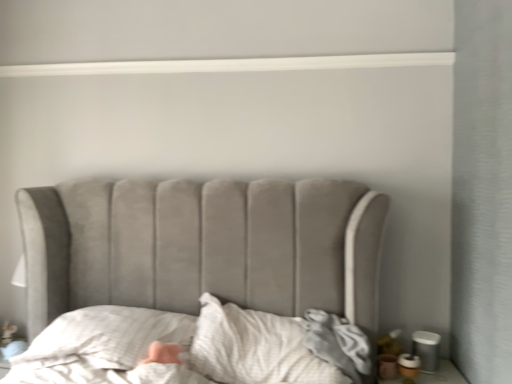
Locate an element on the screen. The width and height of the screenshot is (512, 384). white textured sheet at center is located at coordinates (257, 347).

What do you see at coordinates (257, 347) in the screenshot? The image size is (512, 384). I see `white textured sheet at center` at bounding box center [257, 347].

The image size is (512, 384). What do you see at coordinates (106, 337) in the screenshot?
I see `white textured pillow at lower left` at bounding box center [106, 337].

Find the location of `white textured pillow at lower left`. white textured pillow at lower left is located at coordinates (106, 337).

What is the approximate height of white textured pillow at lower left?

The height of white textured pillow at lower left is 14.50 inches.

Locate an element on the screen. This screenshot has height=384, width=512. white textured sheet at center is located at coordinates click(257, 347).

Would you say white textured sheet at center is to the left or to the right of white textured pillow at lower left in the picture?

Clearly, white textured sheet at center is on the right of white textured pillow at lower left in the image.

Which is in front, white textured sheet at center or white textured pillow at lower left?

white textured sheet at center is closer to the camera.

Does point (204, 338) lie in front of point (35, 345)?

Yes, it is in front of point (35, 345).

From the image's perspective, which one is positioned higher, white textured sheet at center or white textured pillow at lower left?

From the image's view, white textured pillow at lower left is above.

From a real-world perspective, is white textured sheet at center over white textured pillow at lower left?

Incorrect, from a real-world perspective, white textured sheet at center is lower than white textured pillow at lower left.

Considering the sizes of objects white textured sheet at center and white textured pillow at lower left in the image provided, who is wider, white textured sheet at center or white textured pillow at lower left?

Wider between the two is white textured pillow at lower left.

Which of these two, white textured sheet at center or white textured pillow at lower left, stands taller?

white textured sheet at center.

Considering the sizes of white textured sheet at center and white textured pillow at lower left in the image, is white textured sheet at center bigger or smaller than white textured pillow at lower left?

In the image, white textured sheet at center appears to be larger than white textured pillow at lower left.

Choose the correct answer: Is white textured sheet at center inside white textured pillow at lower left or outside it?

The correct answer is: outside.

Is white textured sheet at center touching white textured pillow at lower left?

white textured sheet at center is not next to white textured pillow at lower left, and they're not touching.

Is white textured sheet at center positioned with its back to white textured pillow at lower left?

That's not correct — white textured sheet at center is not looking away from white textured pillow at lower left.

The height and width of the screenshot is (384, 512). I want to click on throw pillow above the white textured sheet at center (from the image's perspective), so click(x=106, y=337).

Is white textured pillow at lower left at the left side of white textured sheet at center?

Correct, you'll find white textured pillow at lower left to the left of white textured sheet at center.

Which is behind, white textured pillow at lower left or white textured sheet at center?

white textured pillow at lower left.

Is point (102, 308) closer or farther from the camera than point (303, 343)?

Point (102, 308) appears to be farther away from the viewer than point (303, 343).

From the image's perspective, which is below, white textured pillow at lower left or white textured sheet at center?

white textured sheet at center is shown below in the image.

From a real-world perspective, which is physically above, white textured pillow at lower left or white textured sheet at center?

white textured pillow at lower left, from a real-world perspective.

Can you confirm if white textured pillow at lower left is thinner than white textured sheet at center?

Incorrect, the width of white textured pillow at lower left is not less than that of white textured sheet at center.

Is white textured pillow at lower left taller than white textured sheet at center?

No, white textured pillow at lower left is not taller than white textured sheet at center.

Is white textured pillow at lower left smaller than white textured sheet at center?

Yes.

Would you say white textured pillow at lower left contains white textured sheet at center?

No, white textured sheet at center is not surrounded by white textured pillow at lower left.

Is white textured pillow at lower left not close to white textured sheet at center?

Actually, white textured pillow at lower left and white textured sheet at center are a little close together.

Based on the photo, is white textured pillow at lower left facing away from white textured sheet at center?

white textured pillow at lower left does not have its back to white textured sheet at center.

Can you tell me how much white textured pillow at lower left and white textured sheet at center differ in facing direction?

1.97 degrees separate the facing orientations of white textured pillow at lower left and white textured sheet at center.

The height and width of the screenshot is (384, 512). Identify the location of sheet lying in front of the white textured pillow at lower left. (257, 347).

This screenshot has height=384, width=512. I want to click on throw pillow above the white textured sheet at center (from a real-world perspective), so click(106, 337).

In the image, there is a white textured pillow at lower left. At what (x,y) coordinates should I click in order to perform the action: click on sheet below it (from a real-world perspective). Please return your answer as a coordinate pair (x, y). This screenshot has height=384, width=512. Looking at the image, I should click on (257, 347).